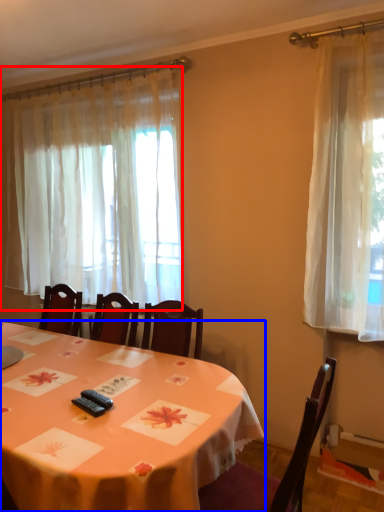
Question: Which object is closer to the camera taking this photo, curtain (highlighted by a red box) or table (highlighted by a blue box)?

Choices:
 (A) curtain
 (B) table

Answer: (B)